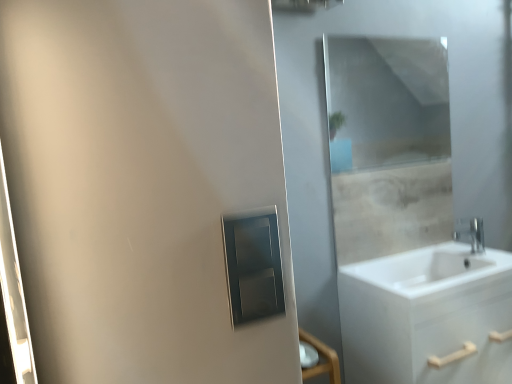
Question: From the image's perspective, relative to white matte cabinet at lower right, is matte silver medicine cabinet at center above or below?

Choices:
 (A) above
 (B) below

Answer: (A)

Question: Choose the correct answer: Is matte silver medicine cabinet at center inside white matte cabinet at lower right or outside it?

Choices:
 (A) inside
 (B) outside

Answer: (B)

Question: Estimate the real-world distances between objects in this image. Which object is farther from the clear glass mirror at upper center?

Choices:
 (A) white matte cabinet at lower right
 (B) silver metallic faucet at right
 (C) matte silver medicine cabinet at center

Answer: (C)

Question: Based on their relative distances, which object is nearer to the silver metallic faucet at right?

Choices:
 (A) matte silver medicine cabinet at center
 (B) white matte cabinet at lower right
 (C) clear glass mirror at upper center

Answer: (B)